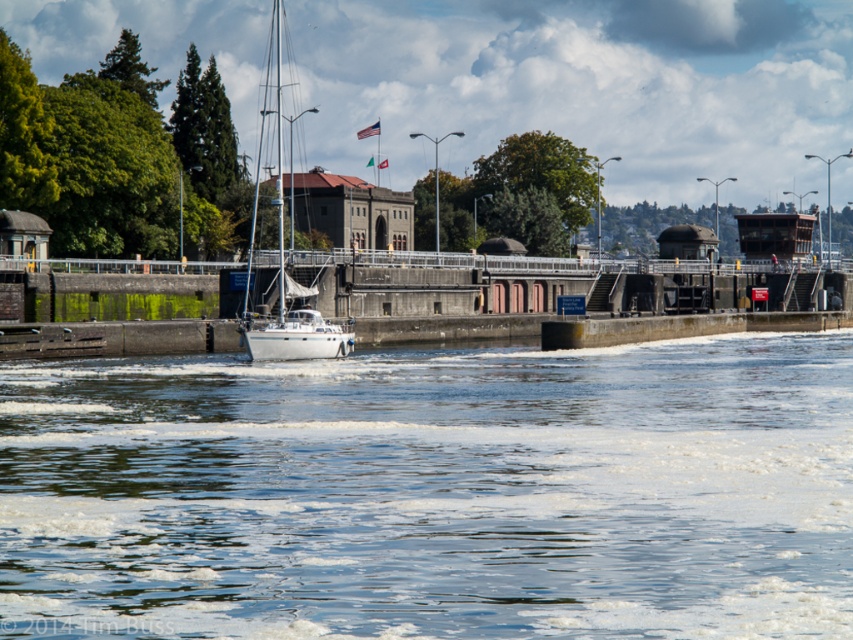
Question: Can you confirm if clear water at center is thinner than white matte sailboat at center?

Choices:
 (A) yes
 (B) no

Answer: (B)

Question: Which point is closer to the camera taking this photo?

Choices:
 (A) (279, 36)
 (B) (676, 371)

Answer: (B)

Question: Among these objects, which one is farthest from the camera?

Choices:
 (A) clear water at center
 (B) white matte sailboat at center

Answer: (B)

Question: Which point appears farthest from the camera in this image?

Choices:
 (A) (270, 109)
 (B) (328, 536)

Answer: (A)

Question: Does clear water at center appear over white matte sailboat at center?

Choices:
 (A) yes
 (B) no

Answer: (B)

Question: Does clear water at center come in front of white matte sailboat at center?

Choices:
 (A) no
 (B) yes

Answer: (B)